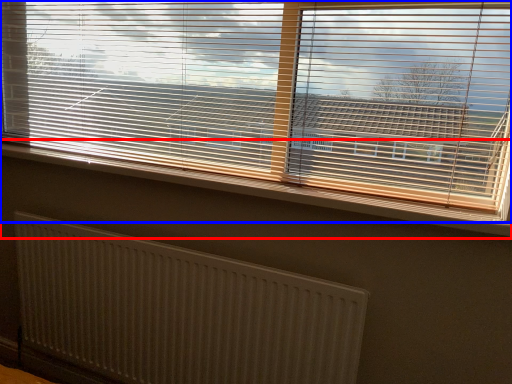
Question: Which object is closer to the camera taking this photo, window sill (highlighted by a red box) or window blind (highlighted by a blue box)?

Choices:
 (A) window sill
 (B) window blind

Answer: (B)